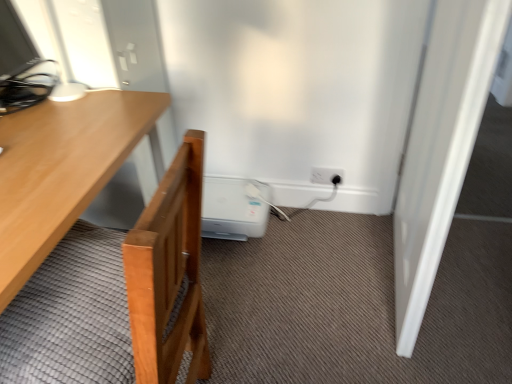
The width and height of the screenshot is (512, 384). Find the location of `free space that is in between white smooth door at right and white plastic water heater at lower center`. free space that is in between white smooth door at right and white plastic water heater at lower center is located at coordinates (312, 263).